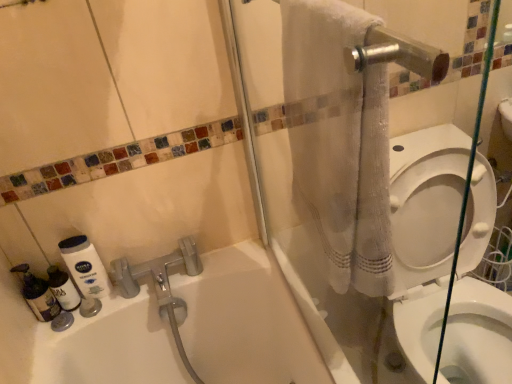
Question: Could you tell me if white glossy toilet at right is facing translucent plastic bottle at lower left, acting as the second cleaning product starting from the left?

Choices:
 (A) no
 (B) yes

Answer: (A)

Question: Is translucent plastic bottle at lower left, the second cleaning product when ordered from right to left, a part of white glossy toilet at right?

Choices:
 (A) yes
 (B) no

Answer: (B)

Question: From the image's perspective, would you say white glossy toilet at right is shown under translucent plastic bottle at lower left, the second cleaning product when ordered from right to left?

Choices:
 (A) no
 (B) yes

Answer: (B)

Question: Would you say white glossy toilet at right is outside translucent plastic bottle at lower left, the second cleaning product when ordered from right to left?

Choices:
 (A) no
 (B) yes

Answer: (B)

Question: Can you confirm if white glossy toilet at right is wider than translucent plastic bottle at lower left, the second cleaning product when ordered from right to left?

Choices:
 (A) yes
 (B) no

Answer: (A)

Question: Does white glossy toilet at right appear on the left side of translucent plastic bottle at lower left, the second cleaning product when ordered from right to left?

Choices:
 (A) no
 (B) yes

Answer: (A)

Question: From the image's perspective, would you say white matte lotion at lower left, which is the first cleaning product from right to left, is shown under translucent plastic bottle at lower left, acting as the second cleaning product starting from the left?

Choices:
 (A) yes
 (B) no

Answer: (B)

Question: Can we say white matte lotion at lower left, which is the first cleaning product from right to left, lies outside translucent plastic bottle at lower left, acting as the second cleaning product starting from the left?

Choices:
 (A) no
 (B) yes

Answer: (B)

Question: Does white matte lotion at lower left, which is the first cleaning product from right to left, have a greater width compared to translucent plastic bottle at lower left, acting as the second cleaning product starting from the left?

Choices:
 (A) yes
 (B) no

Answer: (B)

Question: Does white matte lotion at lower left, which is the first cleaning product from right to left, have a lesser height compared to translucent plastic bottle at lower left, acting as the second cleaning product starting from the left?

Choices:
 (A) no
 (B) yes

Answer: (A)

Question: Can you see white matte lotion at lower left, which ranks as the 3th cleaning product in left-to-right order, touching translucent plastic bottle at lower left, acting as the second cleaning product starting from the left?

Choices:
 (A) yes
 (B) no

Answer: (A)

Question: From the image's perspective, is white matte lotion at lower left, which is the first cleaning product from right to left, over translucent plastic bottle at lower left, acting as the second cleaning product starting from the left?

Choices:
 (A) yes
 (B) no

Answer: (A)

Question: Is white matte lotion at lower left, which ranks as the 3th cleaning product in left-to-right order, thinner than white textured towel at upper right?

Choices:
 (A) no
 (B) yes

Answer: (B)